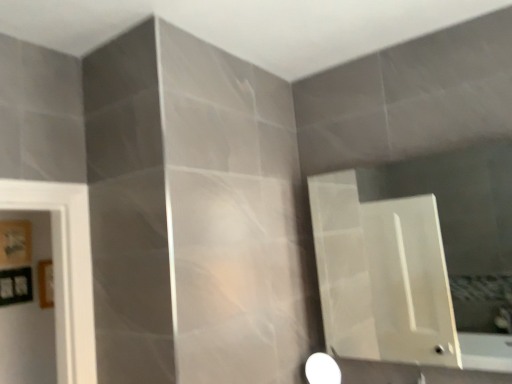
This screenshot has width=512, height=384. Find the location of `white glossy light bulb at lower center`. white glossy light bulb at lower center is located at coordinates (322, 369).

The image size is (512, 384). What do you see at coordinates (322, 369) in the screenshot?
I see `white glossy light bulb at lower center` at bounding box center [322, 369].

At what (x,y) coordinates should I click in order to perform the action: click on white glossy light bulb at lower center. Please return your answer as a coordinate pair (x, y). Looking at the image, I should click on (322, 369).